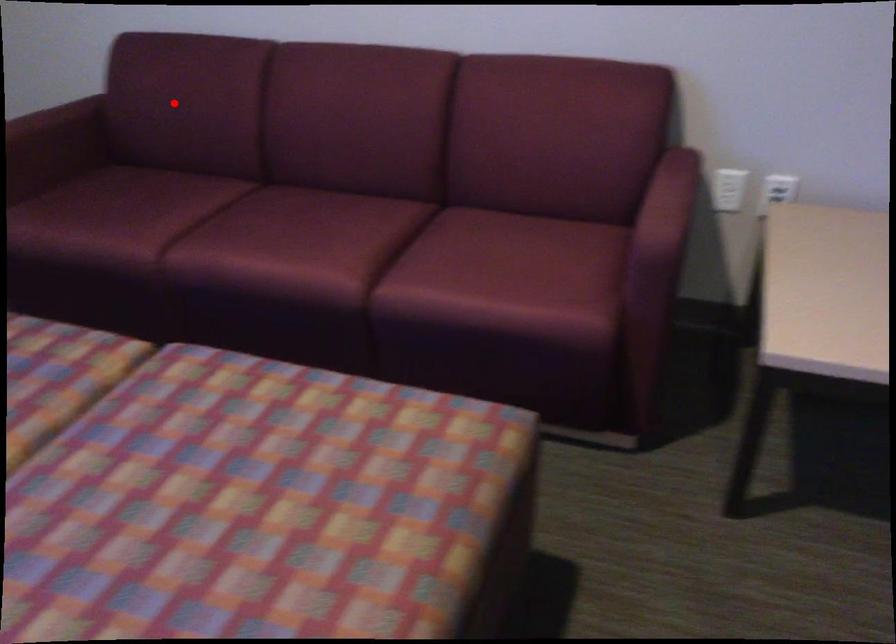
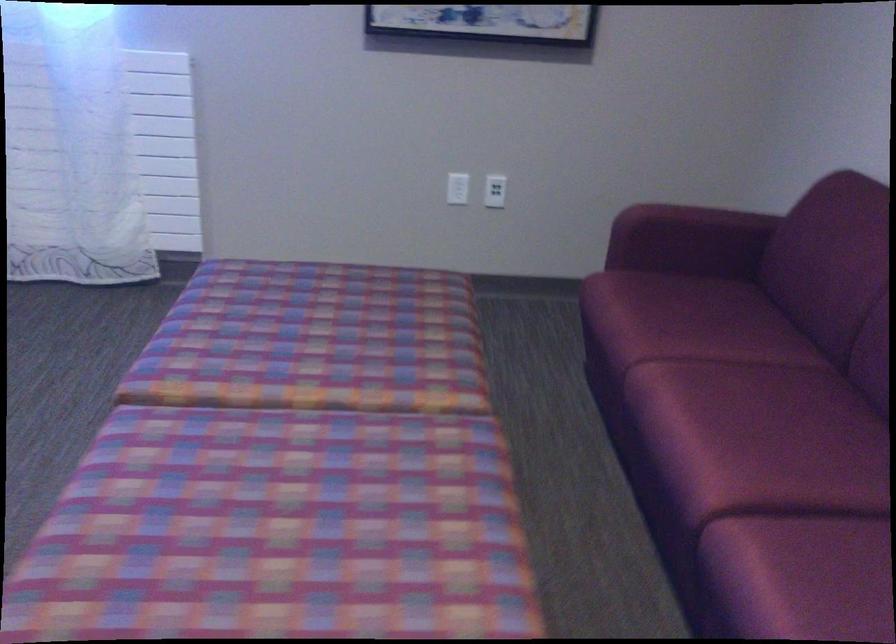
The point at the highlighted location is marked in the first image. Where is the corresponding point in the second image?

(822, 256)